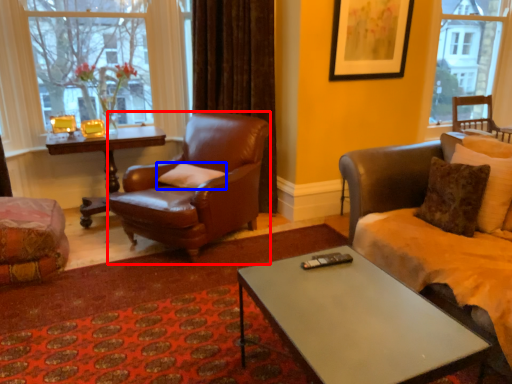
Question: Among these objects, which one is farthest to the camera, chair (highlighted by a red box) or pillow (highlighted by a blue box)?

Choices:
 (A) chair
 (B) pillow

Answer: (B)